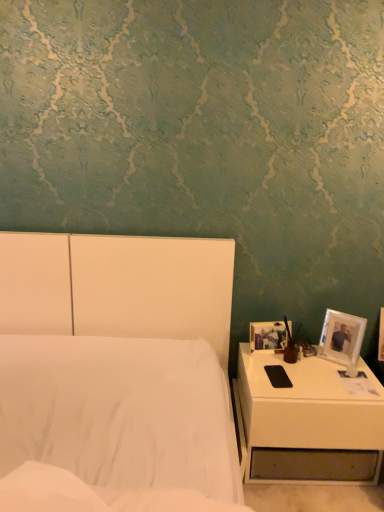
Identify the location of empty space that is ontop of white glossy nightstand at lower right. Image resolution: width=384 pixels, height=512 pixels. (306, 369).